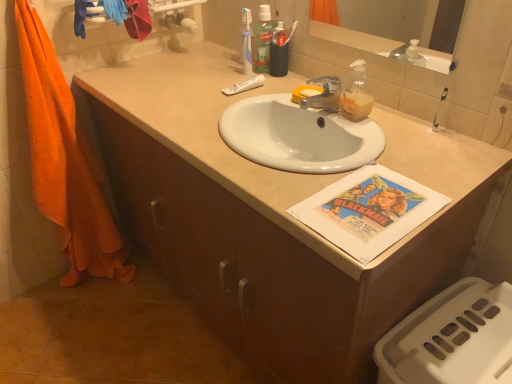
Question: From the image's perspective, is silver metallic faucet at center on orange cotton towel at left?

Choices:
 (A) yes
 (B) no

Answer: (A)

Question: From a real-world perspective, is silver metallic faucet at center under orange cotton towel at left?

Choices:
 (A) yes
 (B) no

Answer: (B)

Question: Does silver metallic faucet at center appear on the right side of orange cotton towel at left?

Choices:
 (A) yes
 (B) no

Answer: (A)

Question: Are silver metallic faucet at center and orange cotton towel at left making contact?

Choices:
 (A) no
 (B) yes

Answer: (A)

Question: Considering the relative positions of silver metallic faucet at center and orange cotton towel at left in the image provided, is silver metallic faucet at center behind orange cotton towel at left?

Choices:
 (A) yes
 (B) no

Answer: (A)

Question: From the image's perspective, is silver metallic faucet at center above or below orange cotton towel at left?

Choices:
 (A) below
 (B) above

Answer: (B)

Question: Choose the correct answer: Is silver metallic faucet at center inside orange cotton towel at left or outside it?

Choices:
 (A) outside
 (B) inside

Answer: (A)

Question: Is silver metallic faucet at center taller or shorter than orange cotton towel at left?

Choices:
 (A) short
 (B) tall

Answer: (A)

Question: Based on their positions, is silver metallic faucet at center located to the left or right of orange cotton towel at left?

Choices:
 (A) left
 (B) right

Answer: (B)

Question: In the image, is silver metallic faucet at center positioned in front of or behind white matte tube at center?

Choices:
 (A) behind
 (B) front

Answer: (B)

Question: Based on their positions, is silver metallic faucet at center located to the left or right of white matte tube at center?

Choices:
 (A) right
 (B) left

Answer: (A)

Question: Is point (329, 96) closer or farther from the camera than point (229, 87)?

Choices:
 (A) closer
 (B) farther

Answer: (A)

Question: From their relative heights in the image, would you say silver metallic faucet at center is taller or shorter than white matte tube at center?

Choices:
 (A) short
 (B) tall

Answer: (B)

Question: Is green plastic mouthwash at upper center taller or shorter than white matte tube at center?

Choices:
 (A) short
 (B) tall

Answer: (B)

Question: Based on their sizes in the image, would you say green plastic mouthwash at upper center is bigger or smaller than white matte tube at center?

Choices:
 (A) big
 (B) small

Answer: (A)